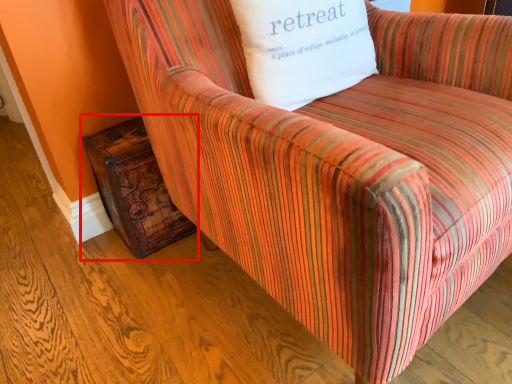
Question: From the image's perspective, where is side table (annotated by the red box) located in relation to pillow in the image?

Choices:
 (A) above
 (B) below

Answer: (B)